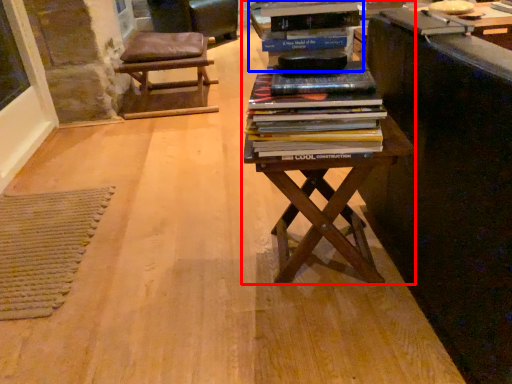
Question: Which point is further to the camera, table (highlighted by a red box) or shelf (highlighted by a blue box)?

Choices:
 (A) table
 (B) shelf

Answer: (B)